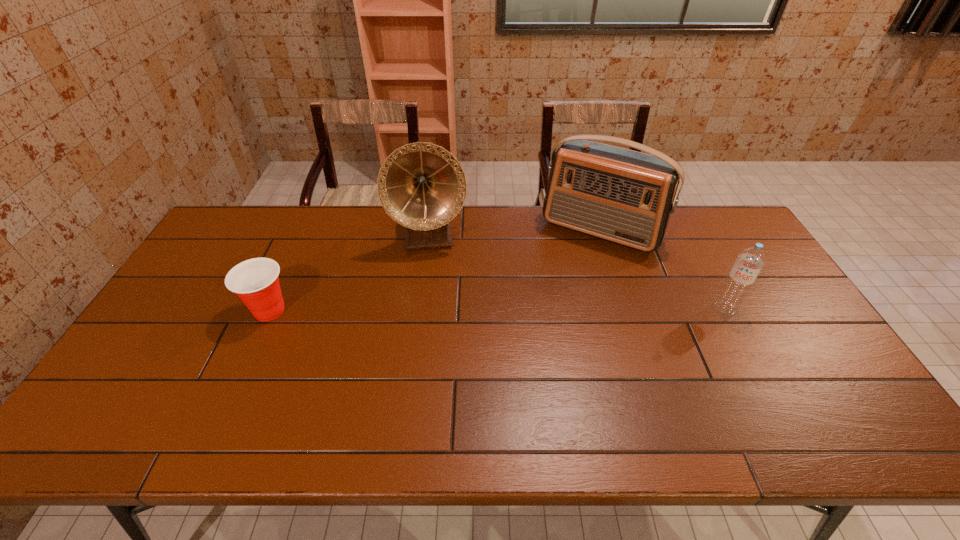
This screenshot has width=960, height=540. I want to click on free point at the far left corner, so click(x=259, y=225).

In the image, there is a desktop. Where is `vacant space at the far right corner`? vacant space at the far right corner is located at coordinates (726, 222).

The image size is (960, 540). Find the location of `vacant space at the near right corner of the desktop`. vacant space at the near right corner of the desktop is located at coordinates (780, 376).

Locate an element on the screen. The height and width of the screenshot is (540, 960). vacant space that's between the third tallest object and the shortest object is located at coordinates (497, 309).

Identify the location of vacant point located between the rightmost object and the radio receiver. point(662,269).

Locate an element on the screen. This screenshot has width=960, height=540. empty space between the water bottle and the radio receiver is located at coordinates (662, 269).

Identify the location of free area in between the shortest object and the second object from left to right. (350, 273).

You are a GUI agent. You are given a task and a screenshot of the screen. Output one action in this format:
    pyautogui.click(x=<x>, y=<y>)
    Task: Click on the free area in between the phonograph record and the water bottle
    The width and height of the screenshot is (960, 540).
    Given the screenshot: What is the action you would take?
    (577, 272)

You are a GUI agent. You are given a task and a screenshot of the screen. Output one action in this format:
    pyautogui.click(x=<x>, y=<y>)
    Task: Click on the empty space that is in between the third object from right to left and the shortest object
    
    Given the screenshot: What is the action you would take?
    pyautogui.click(x=350, y=273)

What are the coordinates of `free point between the radio receiver and the phonograph record` in the screenshot? It's located at (516, 233).